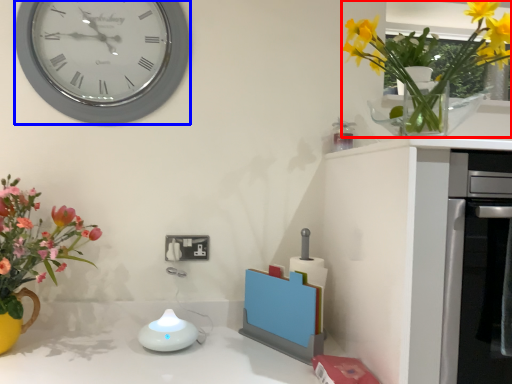
Question: Which point is closer to the camera, floral arrangement (highlighted by a red box) or wall clock (highlighted by a blue box)?

Choices:
 (A) floral arrangement
 (B) wall clock

Answer: (A)